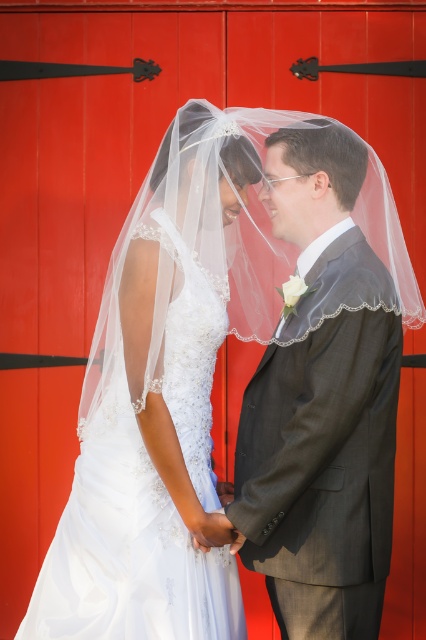
Which is below, gray textured suit at center or white lace wedding dress at center?

white lace wedding dress at center is lower down.

Is the position of gray textured suit at center less distant than that of white lace wedding dress at center?

Yes.

Which is behind, point (230, 506) or point (118, 570)?

Point (118, 570)

What are the coordinates of `gray textured suit at center` in the screenshot? It's located at (322, 401).